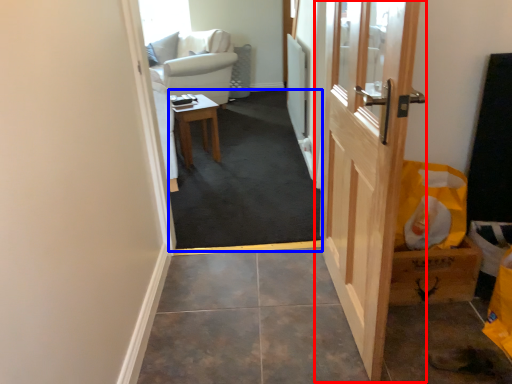
Question: Which object appears farthest to the camera in this image, door (highlighted by a red box) or corridor (highlighted by a blue box)?

Choices:
 (A) door
 (B) corridor

Answer: (B)